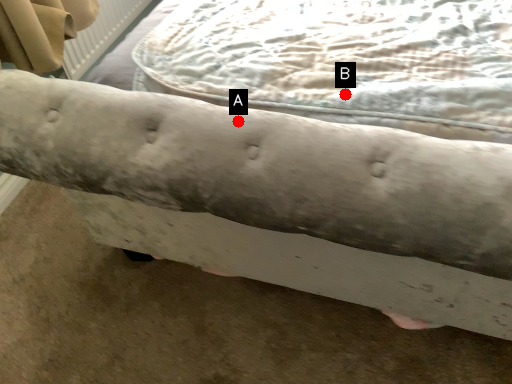
Question: Two points are circled on the image, labeled by A and B beside each circle. Among these points, which one is farthest from the camera?

Choices:
 (A) A is further
 (B) B is further

Answer: (B)